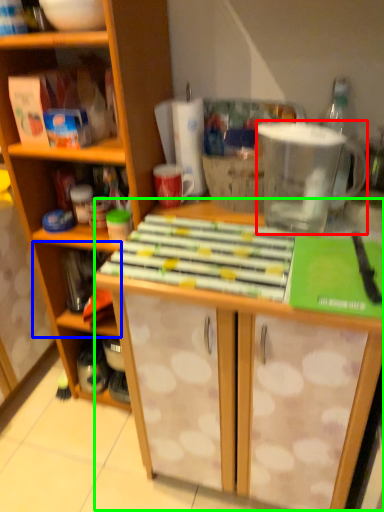
Question: Which object is the farthest from appliance (highlighted by a red box)? Choose among these: shelf (highlighted by a blue box) or table (highlighted by a green box).

Choices:
 (A) shelf
 (B) table

Answer: (A)